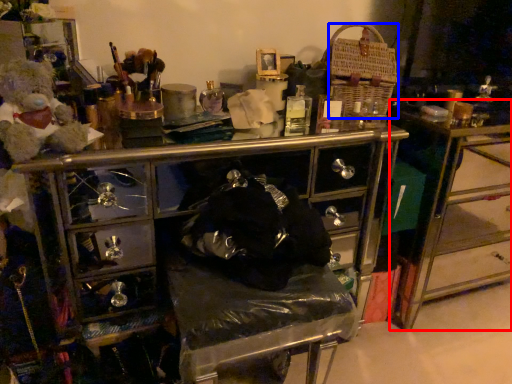
Question: Which object is closer to the camera taking this photo, table (highlighted by a red box) or crate (highlighted by a blue box)?

Choices:
 (A) table
 (B) crate

Answer: (B)